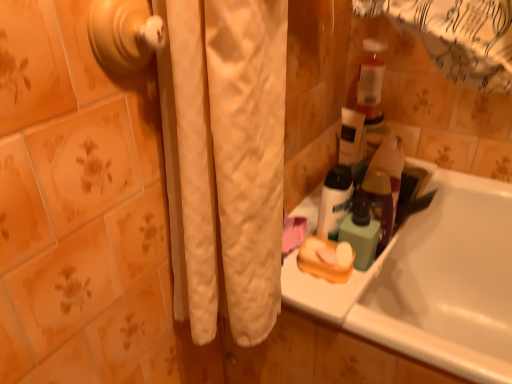
Find the location of `orange matte soap dish at center`. orange matte soap dish at center is located at coordinates (326, 259).

In order to face translucent plastic bottle at upper right, should I rotate leftwards or rightwards?

Rotate right and turn 17.762 degrees.

What is the approximate width of white plastic sink at lower right?

white plastic sink at lower right is 6.69 inches wide.

Where is `white glossy bathtub at lower right`? white glossy bathtub at lower right is located at coordinates [432, 282].

The image size is (512, 384). Find the location of `door handle that is above the white glossy bathtub at lower right (from the image's perspective)`. door handle that is above the white glossy bathtub at lower right (from the image's perspective) is located at coordinates (124, 34).

From a real-world perspective, which object stands above the other?

From a 3D spatial view, gold metallic door handle at upper left is above.

Which object is further away from the camera taking this photo, white glossy bathtub at lower right or gold metallic door handle at upper left?

white glossy bathtub at lower right is behind.

Can you confirm if white glossy bathtub at lower right is positioned to the left of gold metallic door handle at upper left?

No.

From a real-world perspective, which is physically below, white plastic sink at lower right or translucent plastic bottle at upper right?

white plastic sink at lower right.

You are a GUI agent. You are given a task and a screenshot of the screen. Output one action in this format:
    pyautogui.click(x=<x>, y=<y>)
    Task: Click on the cleaning product located behind the white plastic sink at lower right
    This screenshot has width=512, height=384.
    Given the screenshot: What is the action you would take?
    pyautogui.click(x=388, y=157)

Is white plastic sink at lower right situated inside translucent plastic bottle at upper right or outside?

white plastic sink at lower right exists outside the volume of translucent plastic bottle at upper right.

Between white plastic sink at lower right and translucent plastic bottle at upper right, which one has less height?

With less height is white plastic sink at lower right.

Can you confirm if white matte bottle at upper right is smaller than orange matte soap dish at center?

No, white matte bottle at upper right is not smaller than orange matte soap dish at center.

Which of these two, white matte bottle at upper right or orange matte soap dish at center, is thinner?

With smaller width is white matte bottle at upper right.

From the image's perspective, is white matte bottle at upper right under orange matte soap dish at center?

Incorrect, from the image's perspective, white matte bottle at upper right is higher than orange matte soap dish at center.

From the picture: How different are the orientations of white matte bottle at upper right and orange matte soap dish at center in degrees?

There is a 0.000406-degree angle between the facing directions of white matte bottle at upper right and orange matte soap dish at center.

From a real-world perspective, which is physically above, white glossy bathtub at lower right or green matte bottle at upper right?

green matte bottle at upper right.

Which is in front, point (511, 276) or point (361, 253)?

Positioned in front is point (361, 253).

Does white glossy bathtub at lower right have a smaller size compared to green matte bottle at upper right?

Incorrect, white glossy bathtub at lower right is not smaller in size than green matte bottle at upper right.

Consider the image. Considering the relative sizes of white glossy bathtub at lower right and green matte bottle at upper right in the image provided, is white glossy bathtub at lower right taller than green matte bottle at upper right?

Yes.

Which is in front, translucent plastic bottle at upper right or gold metallic door handle at upper left?

gold metallic door handle at upper left is more forward.

Visually, is translucent plastic bottle at upper right positioned to the left or to the right of gold metallic door handle at upper left?

Based on their positions, translucent plastic bottle at upper right is located to the right of gold metallic door handle at upper left.

Based on the photo, from a real-world perspective, does translucent plastic bottle at upper right sit lower than gold metallic door handle at upper left?

Correct, in the physical world, translucent plastic bottle at upper right is lower than gold metallic door handle at upper left.

Does gold metallic door handle at upper left have a greater height compared to white plastic sink at lower right?

Yes, gold metallic door handle at upper left is taller than white plastic sink at lower right.

Consider the image. Can you confirm if gold metallic door handle at upper left is smaller than white plastic sink at lower right?

Correct, gold metallic door handle at upper left occupies less space than white plastic sink at lower right.

Which of these two, gold metallic door handle at upper left or white plastic sink at lower right, is wider?

With larger width is white plastic sink at lower right.

Is white glossy bathtub at lower right shorter than white matte bottle at upper right?

No.

Does white glossy bathtub at lower right turn towards white matte bottle at upper right?

No, white glossy bathtub at lower right is not facing towards white matte bottle at upper right.

Is white glossy bathtub at lower right positioned far away from white matte bottle at upper right?

They are positioned close to each other.

How different are the orientations of white glossy bathtub at lower right and white matte bottle at upper right in degrees?

The angle between the facing direction of white glossy bathtub at lower right and the facing direction of white matte bottle at upper right is 89.6 degrees.

What are the coordinates of `bathtub behind the gold metallic door handle at upper left` in the screenshot? It's located at (432, 282).

You are a GUI agent. You are given a task and a screenshot of the screen. Output one action in this format:
    pyautogui.click(x=<x>, y=<y>)
    Task: Click on the sink on the left of translucent plastic bottle at upper right
    Image resolution: width=512 pixels, height=384 pixels.
    Given the screenshot: What is the action you would take?
    pyautogui.click(x=328, y=287)

Estimate the real-world distances between objects in this image. Which object is closer to white matte bottle at upper right, orange matte soap dish at center or white plastic sink at lower right?

The object closer to white matte bottle at upper right is orange matte soap dish at center.

When comparing their distances from gold metallic door handle at upper left, does white matte bottle at upper right or translucent plastic bottle at upper right seem closer?

white matte bottle at upper right is closer to gold metallic door handle at upper left.

Estimate the real-world distances between objects in this image. Which object is further from orange matte soap dish at center, translucent plastic bottle at upper right or white glossy bathtub at lower right?

The object further to orange matte soap dish at center is white glossy bathtub at lower right.

When comparing their distances from white matte bottle at upper right, does white plastic sink at lower right or green matte bottle at upper right seem closer?

green matte bottle at upper right is closer to white matte bottle at upper right.

From the picture: When comparing their distances from orange matte soap dish at center, does white matte bottle at upper right or white glossy bathtub at lower right seem further?

The object further to orange matte soap dish at center is white glossy bathtub at lower right.

In the scene shown: When comparing their distances from translucent plastic bottle at upper right, does orange matte soap dish at center or white plastic sink at lower right seem further?

Based on the image, orange matte soap dish at center appears to be further to translucent plastic bottle at upper right.

Estimate the real-world distances between objects in this image. Which object is further from green matte bottle at upper right, white matte bottle at upper right or orange matte soap dish at center?

orange matte soap dish at center is further to green matte bottle at upper right.

From the image, which object appears to be nearer to translucent plastic bottle at upper right, gold metallic door handle at upper left or white matte bottle at upper right?

white matte bottle at upper right is closer to translucent plastic bottle at upper right.

This screenshot has height=384, width=512. I want to click on sink situated between gold metallic door handle at upper left and translucent plastic bottle at upper right from left to right, so click(x=328, y=287).

Image resolution: width=512 pixels, height=384 pixels. What are the coordinates of `toiletry between gold metallic door handle at upper left and white glossy bathtub at lower right in the vertical direction` in the screenshot? It's located at (334, 201).

Identify the location of mouthwash between gold metallic door handle at upper left and white plastic sink at lower right from left to right. This screenshot has width=512, height=384. (361, 232).

Identify the location of mouthwash between gold metallic door handle at upper left and white matte bottle at upper right along the z-axis. (x=361, y=232).